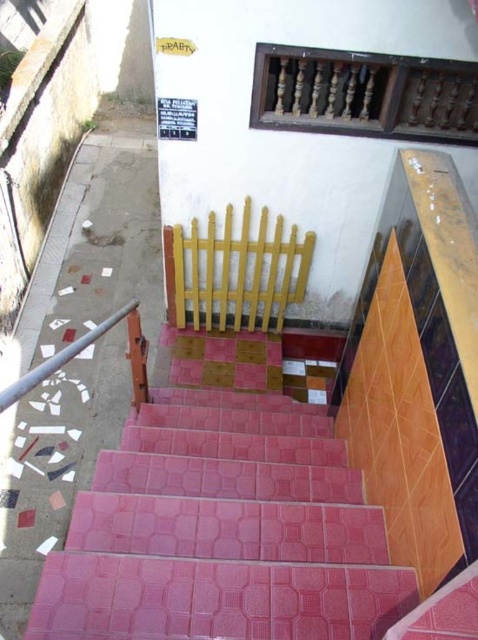
Question: Is wooden balustrade at upper center below metallic pole at left?

Choices:
 (A) yes
 (B) no

Answer: (B)

Question: Among these points, which one is nearest to the camera?

Choices:
 (A) (387, 54)
 (B) (110, 317)

Answer: (A)

Question: From the image, what is the correct spatial relationship of wooden balustrade at upper center in relation to metallic pole at left?

Choices:
 (A) below
 (B) above

Answer: (B)

Question: Which of the following is the farthest from the observer?

Choices:
 (A) (395, 128)
 (B) (106, 321)

Answer: (B)

Question: Considering the relative positions of wooden balustrade at upper center and metallic pole at left in the image provided, where is wooden balustrade at upper center located with respect to metallic pole at left?

Choices:
 (A) left
 (B) right

Answer: (B)